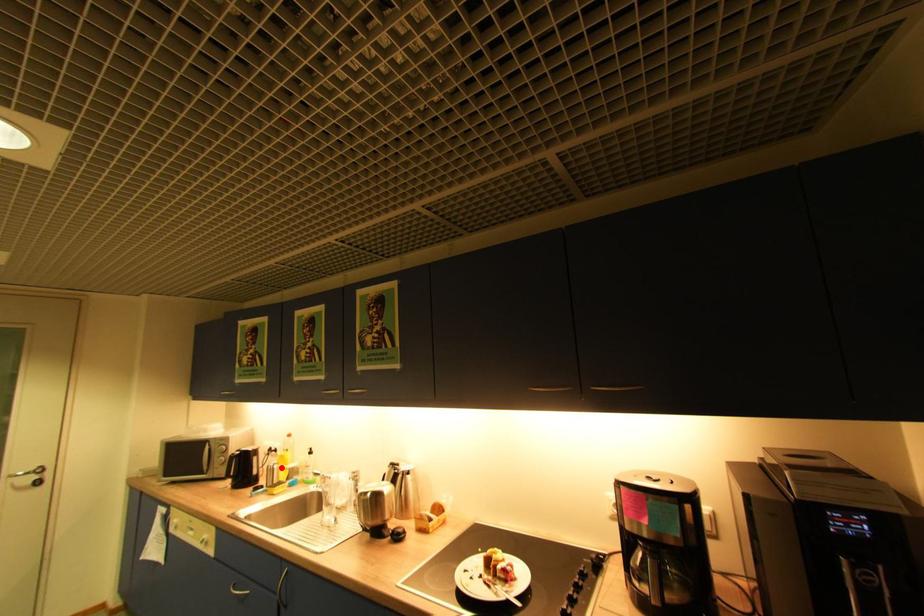
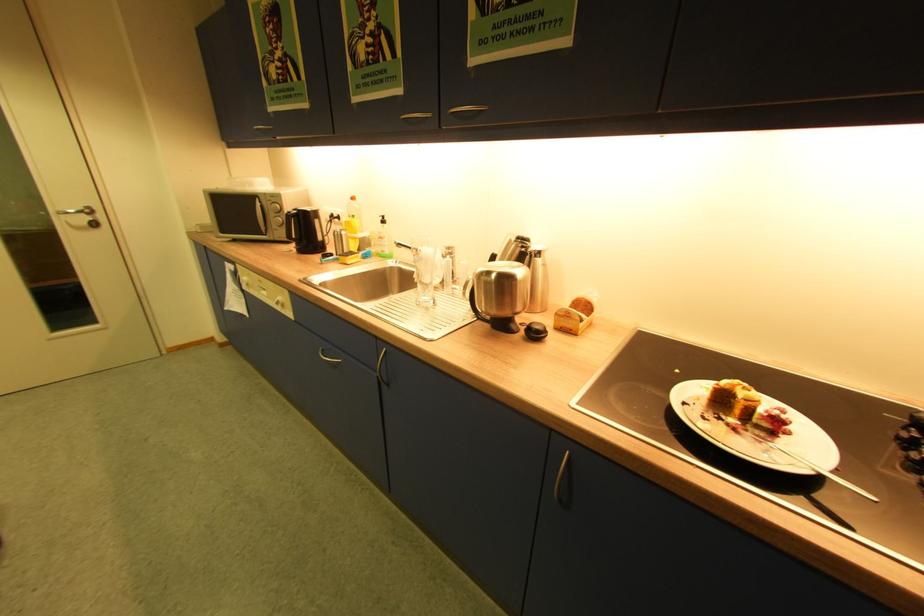
Where in the second image is the point corresponding to the highlighted location from the first image?

(348, 233)